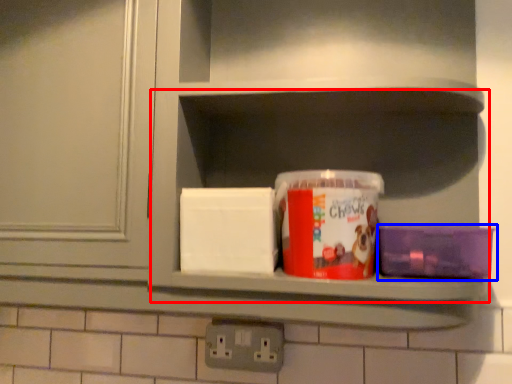
Question: Which object is closer to the camera taking this photo, cabinet (highlighted by a red box) or box (highlighted by a blue box)?

Choices:
 (A) cabinet
 (B) box

Answer: (A)